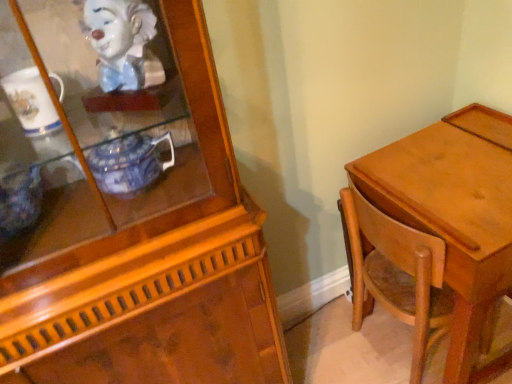
The width and height of the screenshot is (512, 384). Describe the element at coordinates (397, 274) in the screenshot. I see `wooden chair at right` at that location.

In order to face wooden chair at right, should I rotate leftwards or rightwards?

A 20.220 degree turn to the right will do.

Locate an element on the screen. The width and height of the screenshot is (512, 384). wooden chair at right is located at coordinates (397, 274).

Measure the distance between point [356,199] and camera.

A distance of 1.15 meters exists between point [356,199] and camera.

In order to click on wooden chair at right in this screenshot , I will do `click(397, 274)`.